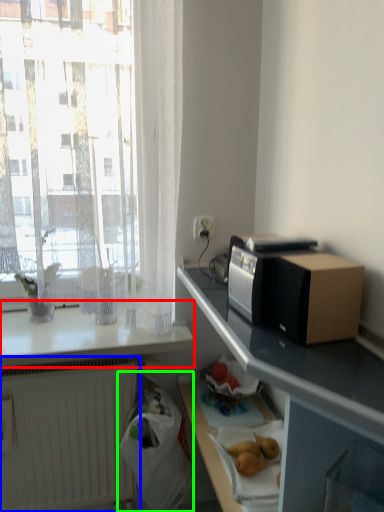
Question: Estimate the real-world distances between objects in this image. Which object is farther from countertop (highlighted by a red box), radiator (highlighted by a blue box) or shopping bag (highlighted by a green box)?

Choices:
 (A) radiator
 (B) shopping bag

Answer: (B)